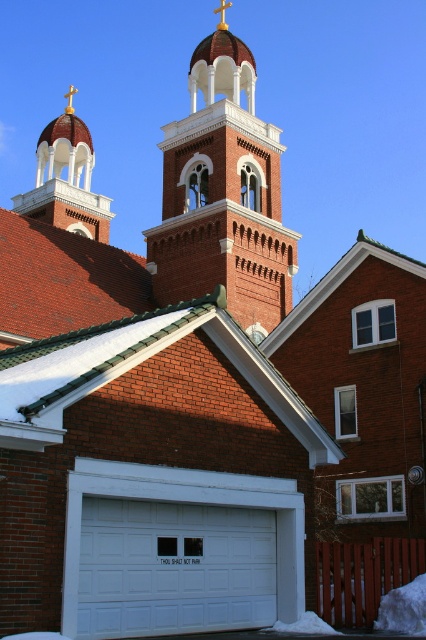
Question: Does white painted wood garage door at center appear on the left side of gold cross at upper center?

Choices:
 (A) yes
 (B) no

Answer: (B)

Question: Which point appears farthest from the camera in this image?

Choices:
 (A) (195, 218)
 (B) (100, 577)

Answer: (A)

Question: Is white painted wood garage door at center to the left of gold cross at upper center from the viewer's perspective?

Choices:
 (A) no
 (B) yes

Answer: (A)

Question: Which of the following is the farthest from the observer?

Choices:
 (A) gold cross at upper center
 (B) brick bell tower at center
 (C) white painted wood garage door at center

Answer: (A)

Question: In this image, where is brick bell tower at center located relative to white painted wood garage door at center?

Choices:
 (A) below
 (B) above

Answer: (B)

Question: Which is farther from the white painted wood garage door at center?

Choices:
 (A) brick bell tower at center
 (B) gold cross at upper center

Answer: (B)